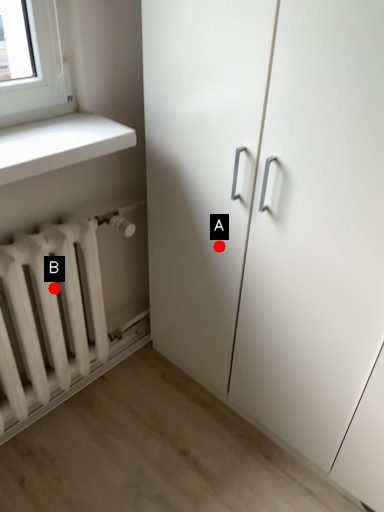
Question: Two points are circled on the image, labeled by A and B beside each circle. Which point is farther to the camera?

Choices:
 (A) A is further
 (B) B is further

Answer: (B)